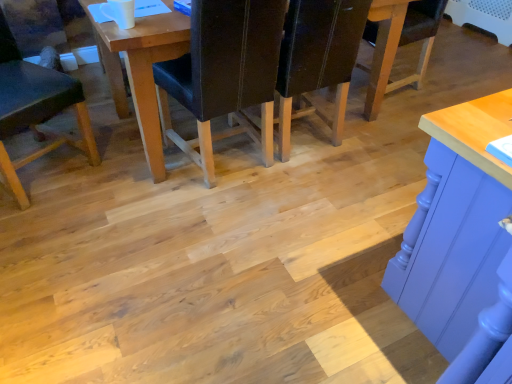
Question: Does point (280, 79) appear closer or farther from the camera than point (147, 82)?

Choices:
 (A) closer
 (B) farther

Answer: (B)

Question: Visually, is dark brown leather chair at center, which is the first chair from right to left, positioned to the left or to the right of wooden table at center?

Choices:
 (A) right
 (B) left

Answer: (A)

Question: Estimate the real-world distances between objects in this image. Which object is farther from the dark brown leather chair at center, which appears as the third chair when viewed from the left?

Choices:
 (A) wooden table at center
 (B) black leather chair at center, arranged as the second chair when viewed from the left
 (C) matte black chair at lower left, the first chair viewed from the left

Answer: (C)

Question: Which object is positioned closest to the matte black chair at lower left, the first chair viewed from the left?

Choices:
 (A) dark brown leather chair at center, which appears as the third chair when viewed from the left
 (B) black leather chair at center, arranged as the second chair when viewed from the left
 (C) wooden table at center

Answer: (C)